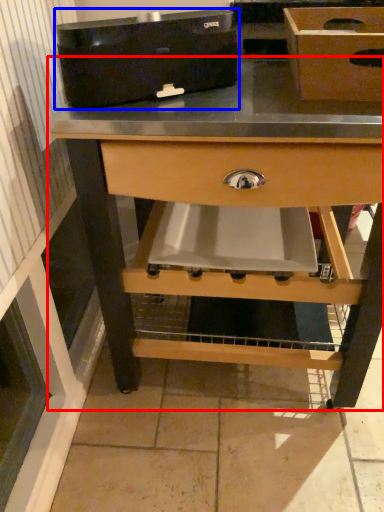
Question: Which of the following is the farthest to the observer, table (highlighted by a red box) or appliance (highlighted by a blue box)?

Choices:
 (A) table
 (B) appliance

Answer: (A)